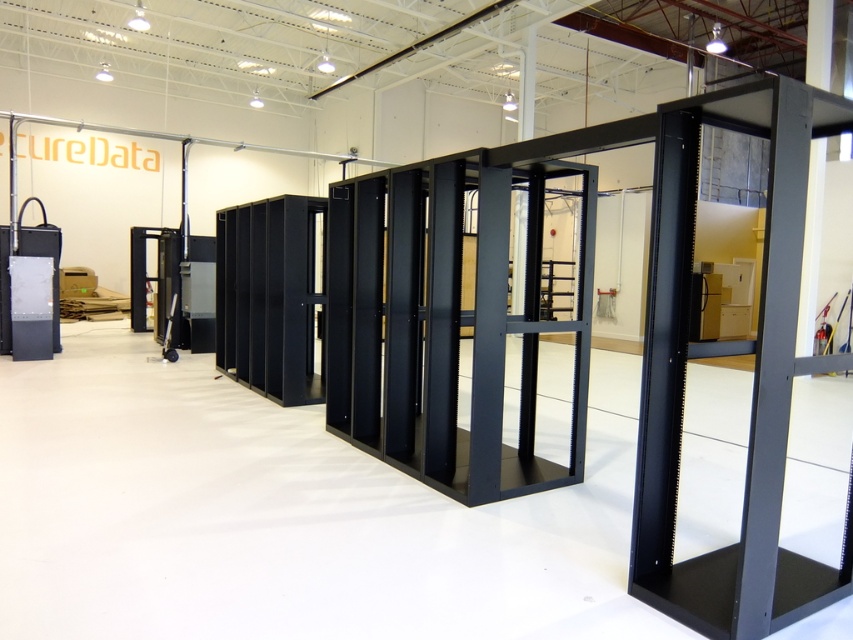
Does black metal server rack at center have a greater width compared to metallic gray server rack at center?

Yes.

Who is positioned more to the right, black metal server rack at center or metallic gray server rack at center?

black metal server rack at center

What do you see at coordinates (730, 353) in the screenshot? The height and width of the screenshot is (640, 853). I see `black metal server rack at center` at bounding box center [730, 353].

Find the location of a particular element. The image size is (853, 640). black metal server rack at center is located at coordinates (730, 353).

Is black metal server rack at center positioned at the back of matte black server at left?

No.

How distant is black metal server rack at center from matte black server at left?

8.38 meters

Identify the location of black metal server rack at center. This screenshot has height=640, width=853. (x=730, y=353).

Is matte black server at left shorter than metallic gray server rack at center?

In fact, matte black server at left may be taller than metallic gray server rack at center.

Is matte black server at left to the left of metallic gray server rack at center from the viewer's perspective?

Indeed, matte black server at left is positioned on the left side of metallic gray server rack at center.

Is point (26, 204) farther from camera compared to point (170, 346)?

Yes.

At what (x,y) coordinates should I click in order to perform the action: click on matte black server at left. Please return your answer as a coordinate pair (x, y). This screenshot has width=853, height=640. Looking at the image, I should click on (28, 289).